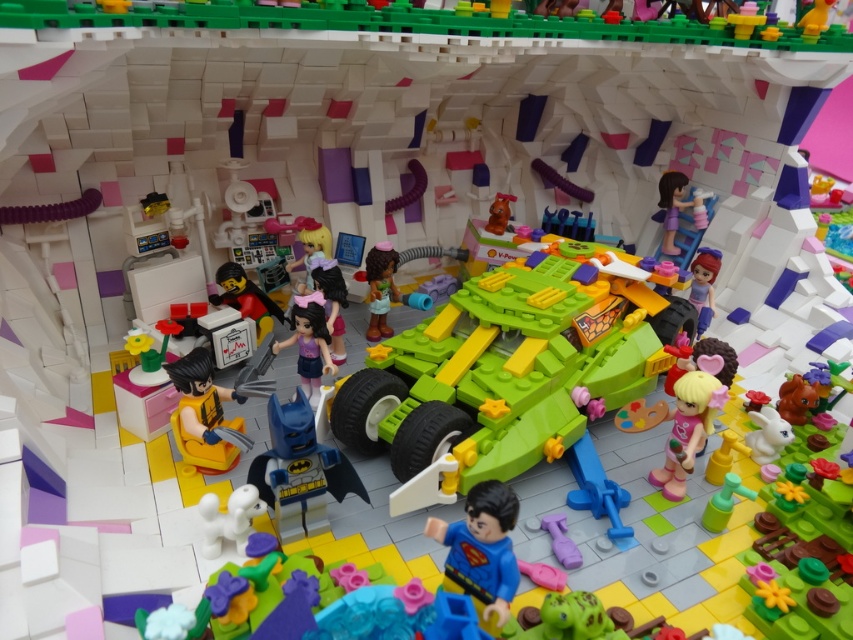
Does smooth blue suit at center have a greater height compared to matte black figure at center-left?

Yes.

Does point (486, 605) lie in front of point (244, 291)?

Yes, it is.

Find the location of a particular element. smooth blue suit at center is located at coordinates (480, 552).

Can you confirm if white matte dog at center is taller than smooth purple dress at upper right?

Incorrect, white matte dog at center's height is not larger of smooth purple dress at upper right's.

Does white matte dog at center appear on the right side of smooth purple dress at upper right?

No, white matte dog at center is not to the right of smooth purple dress at upper right.

Which is in front, point (199, 504) or point (663, 248)?

Point (199, 504) is in front.

You are a GUI agent. You are given a task and a screenshot of the screen. Output one action in this format:
    pyautogui.click(x=<x>, y=<y>)
    Task: Click on the white matte dog at center
    The width and height of the screenshot is (853, 640).
    Given the screenshot: What is the action you would take?
    pyautogui.click(x=229, y=518)

Is the position of green plastic car at center less distant than that of purple matte dress at center?

Yes, green plastic car at center is in front of purple matte dress at center.

From the picture: Can you confirm if green plastic car at center is thinner than purple matte dress at center?

Incorrect, green plastic car at center's width is not less than purple matte dress at center's.

Where is `green plastic car at center`? green plastic car at center is located at coordinates (498, 374).